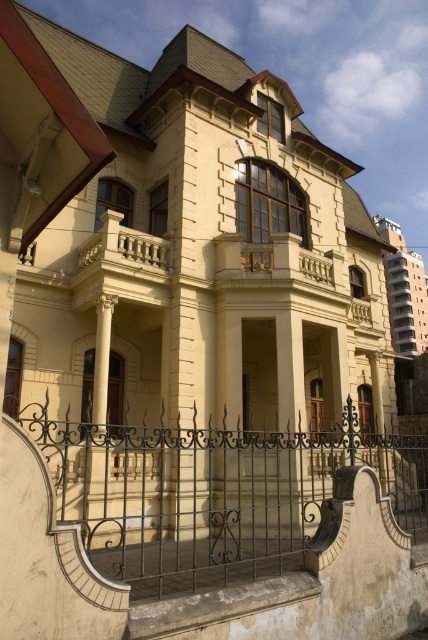
You are a visitor approaching the grand building and notice the green wrought iron gate at lower center and the white glossy column at center. Which object is taller?

The green wrought iron gate at lower center is taller than the white glossy column at center according to the description provided.

You are standing in front of the grand building and want to walk through the green wrought iron gate at lower center. Is the white glossy column at center blocking your path?

The green wrought iron gate at lower center is closer to the viewer than the white glossy column at center, so the white glossy column at center is behind the gate and not blocking your path.